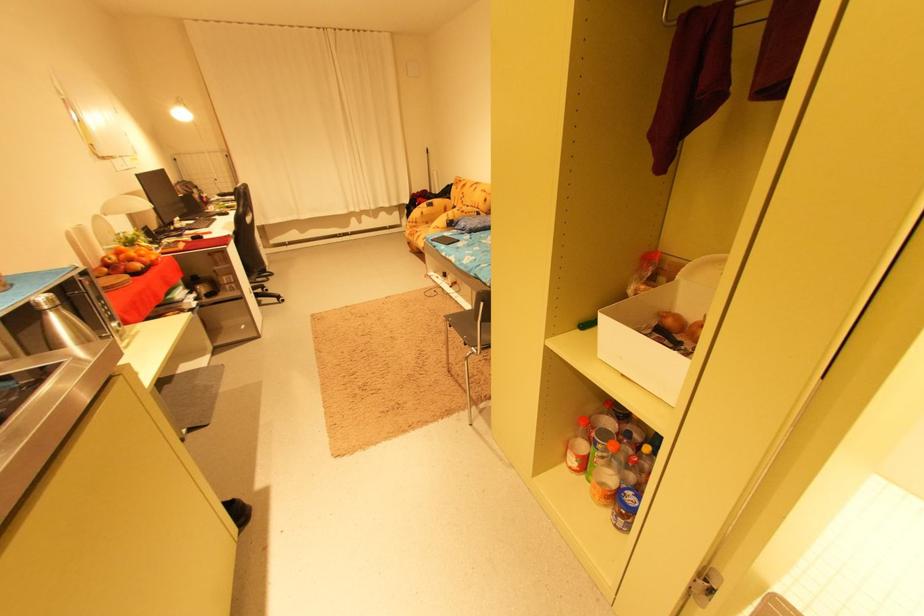
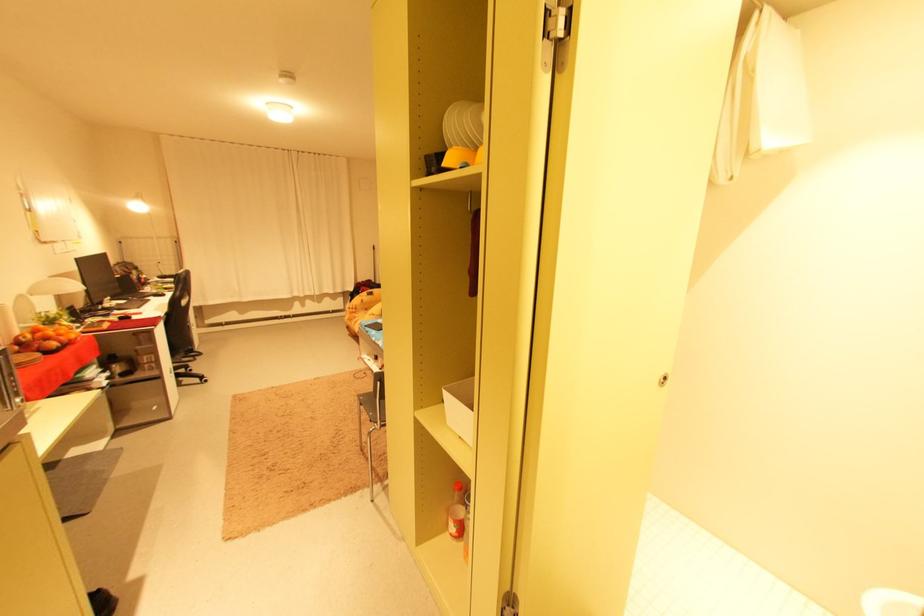
Which direction would the cameraman need to move to produce the second image?

The cameraman moved toward right, backward.